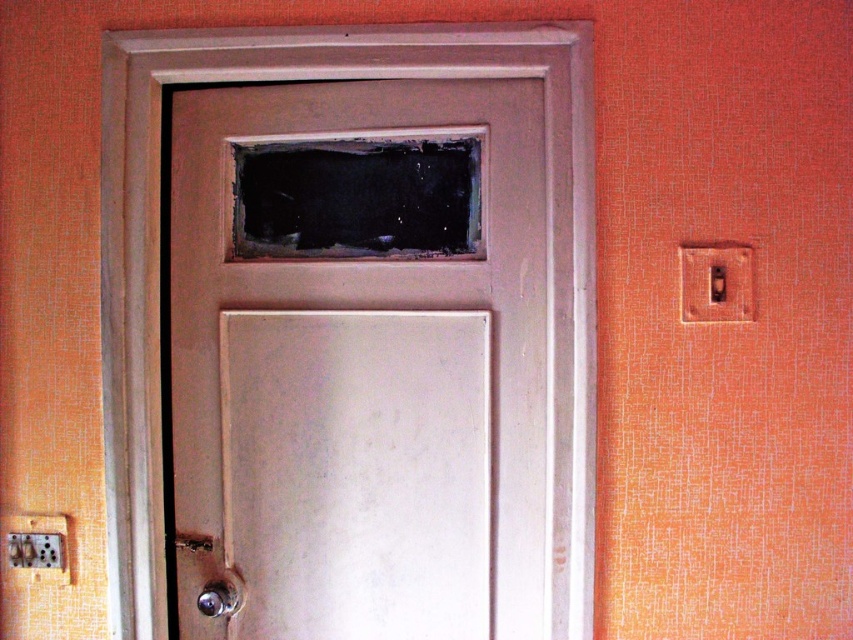
Question: Can you confirm if polished silver knob at lower left is smaller than metallic silver door handle at lower left?

Choices:
 (A) no
 (B) yes

Answer: (A)

Question: Is the position of matte wood door at center more distant than that of polished silver knob at lower left?

Choices:
 (A) no
 (B) yes

Answer: (A)

Question: Which of the following is the closest to the observer?

Choices:
 (A) (213, 611)
 (B) (148, 497)
 (C) (207, 547)

Answer: (B)

Question: Which point is closer to the camera?

Choices:
 (A) metallic silver door handle at lower left
 (B) matte wood door at center
 (C) polished silver knob at lower left

Answer: (B)

Question: Can you confirm if polished silver knob at lower left is bigger than metallic silver door handle at lower left?

Choices:
 (A) yes
 (B) no

Answer: (A)

Question: Which object is positioned farthest from the polished silver knob at lower left?

Choices:
 (A) matte wood door at center
 (B) metallic silver door handle at lower left

Answer: (A)